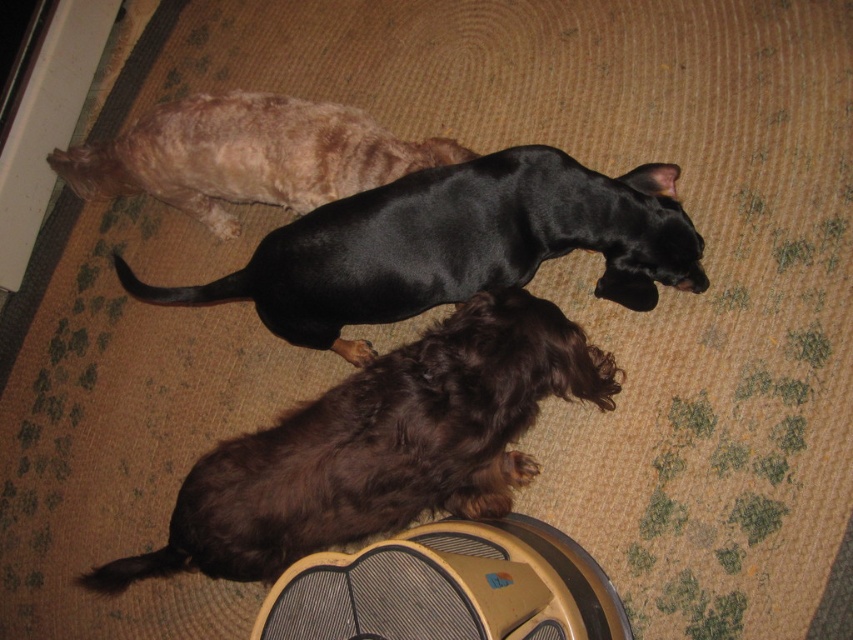
Does black glossy dog at center appear on the left side of gray fabric fan at lower center?

Indeed, black glossy dog at center is positioned on the left side of gray fabric fan at lower center.

Looking at this image, is black glossy dog at center thinner than gray fabric fan at lower center?

Incorrect, black glossy dog at center's width is not less than gray fabric fan at lower center's.

Between point (175, 296) and point (387, 572), which one is positioned behind?

The point (175, 296) is behind.

Where is `black glossy dog at center`? The height and width of the screenshot is (640, 853). black glossy dog at center is located at coordinates (454, 244).

Who is more forward, (x=548, y=192) or (x=204, y=161)?

Positioned in front is point (x=548, y=192).

From the picture: Is black glossy dog at center positioned before black shiny dog at upper center?

Yes.

This screenshot has width=853, height=640. Find the location of `black glossy dog at center`. black glossy dog at center is located at coordinates (454, 244).

This screenshot has height=640, width=853. In order to click on black glossy dog at center in this screenshot , I will do `click(454, 244)`.

Can you confirm if brown fuzzy dog at lower center is wider than black shiny dog at upper center?

In fact, brown fuzzy dog at lower center might be narrower than black shiny dog at upper center.

Is point (335, 406) farther from viewer compared to point (305, 196)?

No, (335, 406) is closer to viewer.

Measure the distance between point (x=512, y=371) and camera.

4.42 feet

Identify the location of brown fuzzy dog at lower center. (380, 445).